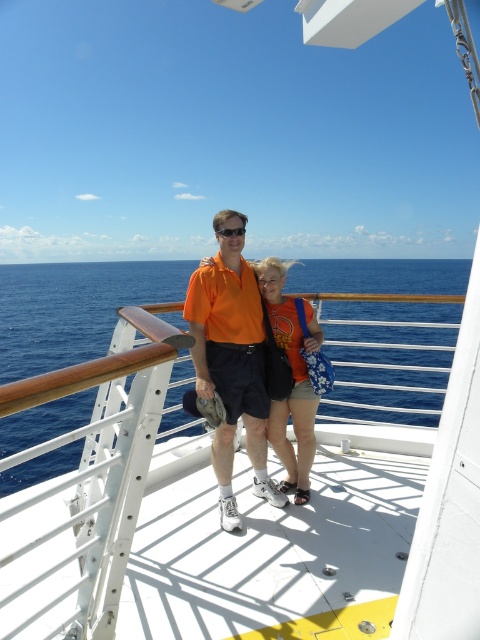
Consider the image. Can you confirm if orange matte shirt at center is smaller than orange cotton t-shirt at center?

Incorrect, orange matte shirt at center is not smaller in size than orange cotton t-shirt at center.

Is point (238, 280) farther from camera compared to point (276, 416)?

No, it is in front of (276, 416).

The width and height of the screenshot is (480, 640). What do you see at coordinates (231, 368) in the screenshot?
I see `orange matte shirt at center` at bounding box center [231, 368].

Find the location of a particular element. The width and height of the screenshot is (480, 640). orange matte shirt at center is located at coordinates (231, 368).

Which is behind, point (265, 465) or point (232, 228)?

The point (265, 465) is behind.

Which is above, orange matte shirt at center or black plastic goggles at center?

black plastic goggles at center is higher up.

At what (x,y) coordinates should I click in order to perform the action: click on orange matte shirt at center. Please return your answer as a coordinate pair (x, y). Looking at the image, I should click on (231, 368).

Image resolution: width=480 pixels, height=640 pixels. What are the coordinates of `orange matte shirt at center` in the screenshot? It's located at (231, 368).

Can you confirm if orange cotton t-shirt at center is shorter than black plastic goggles at center?

No.

Does orange cotton t-shirt at center come in front of black plastic goggles at center?

No, orange cotton t-shirt at center is behind black plastic goggles at center.

Find the location of a particular element. This screenshot has width=480, height=640. orange cotton t-shirt at center is located at coordinates [294, 378].

Locate an element on the screen. Image resolution: width=480 pixels, height=640 pixels. orange cotton t-shirt at center is located at coordinates (294, 378).